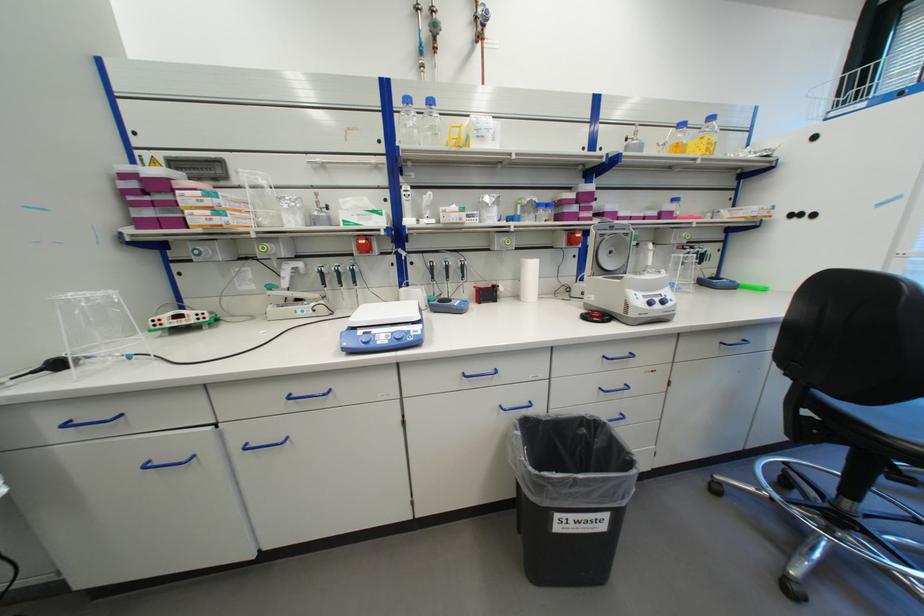
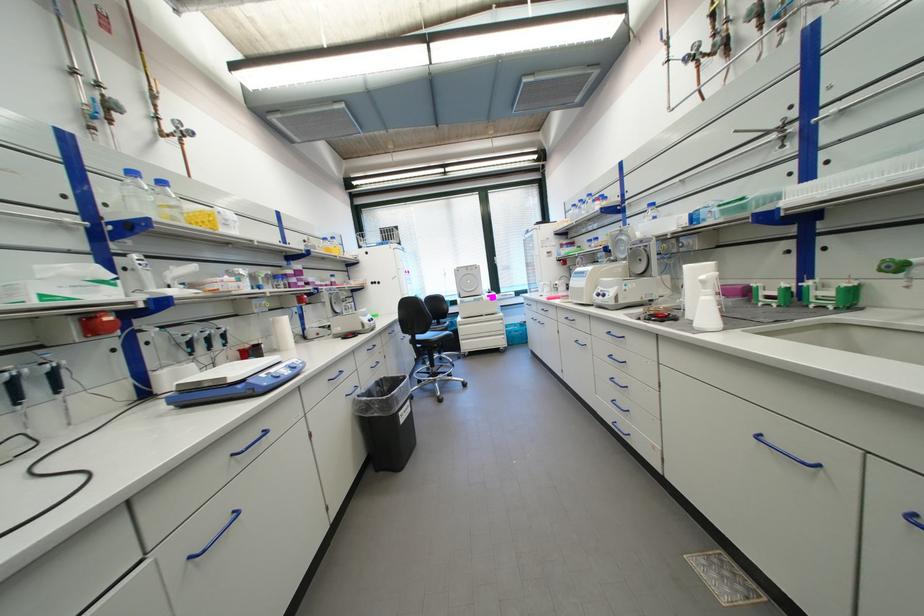
The point at (373, 249) is marked in the first image. Where is the corresponding point in the second image?

(101, 331)